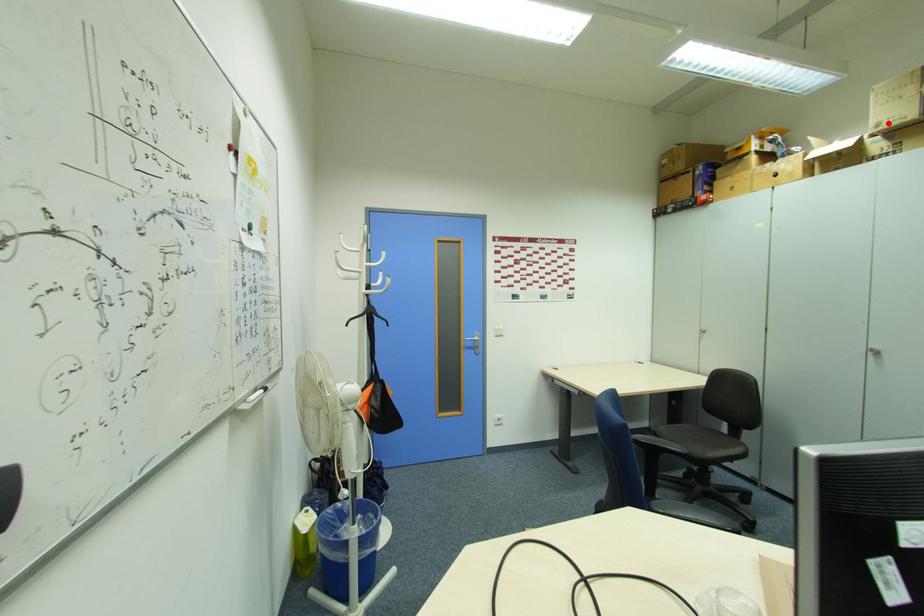
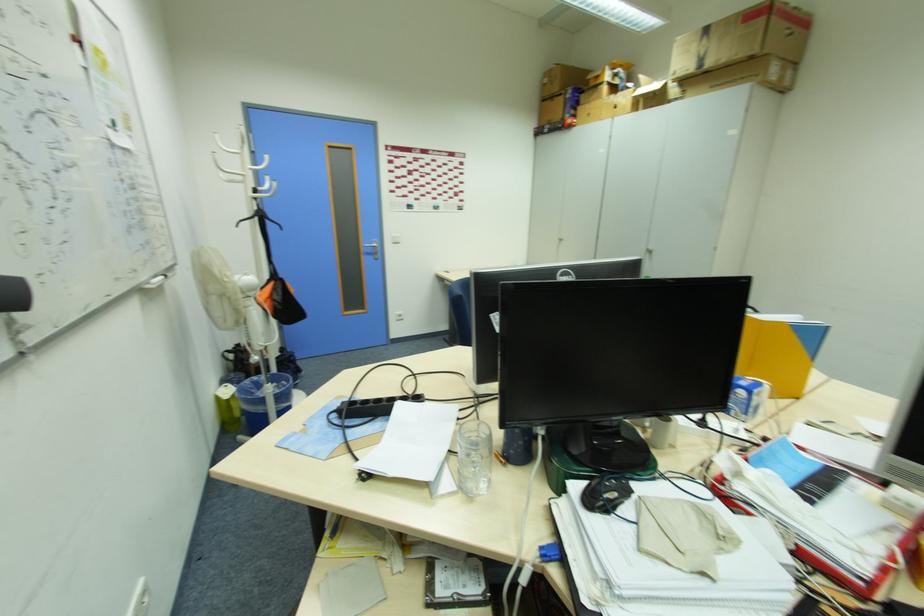
Question: A red point is marked in image1. In image2, is the corresponding 3D point closer to the camera or farther? Reply with the corresponding letter.

Choices:
 (A) The corresponding 3D point is closer.
 (B) The corresponding 3D point is farther.

Answer: (A)